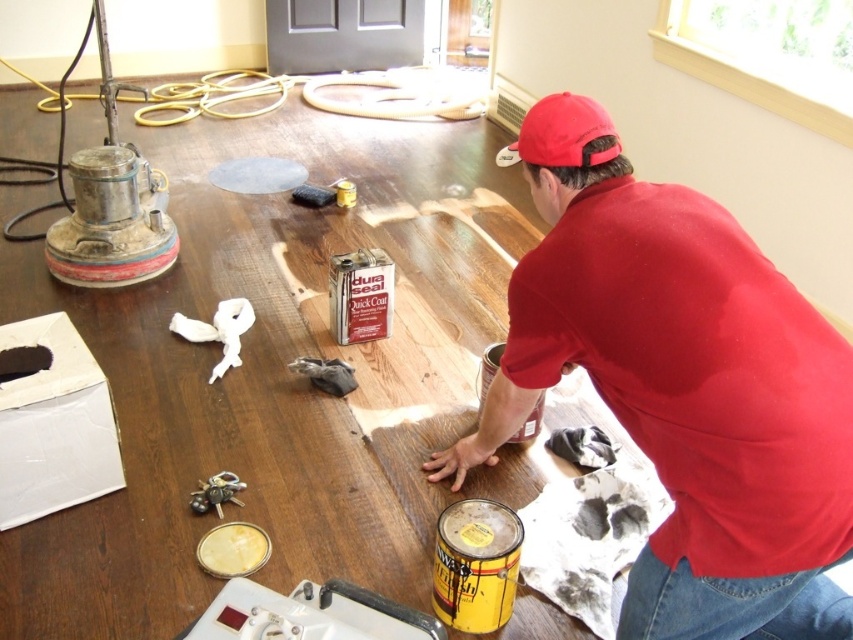
Between point (659, 326) and point (561, 113), which one is positioned in front?

Point (659, 326) is in front.

Describe the element at coordinates (688, 401) in the screenshot. I see `matte red shirt at center` at that location.

Identify the location of matte red shirt at center. (x=688, y=401).